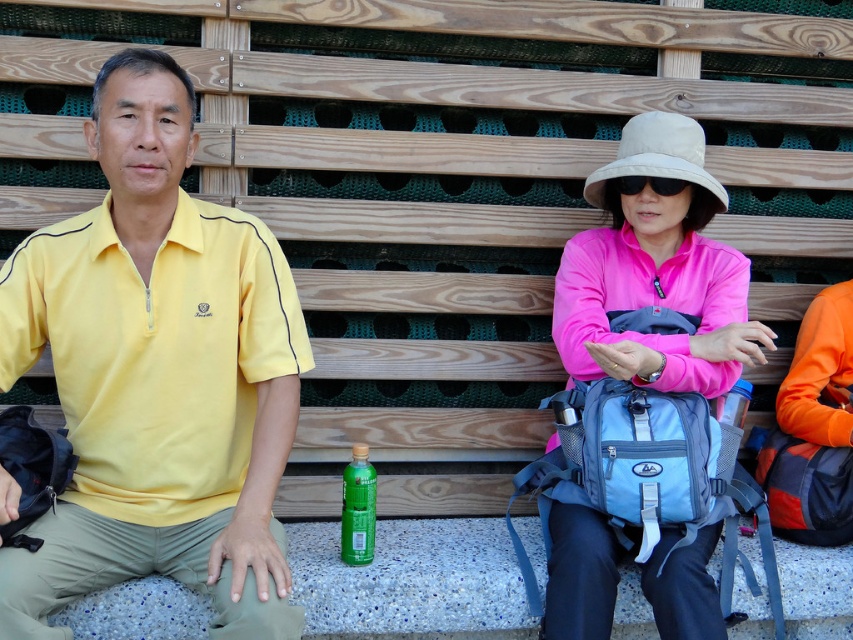
From the picture: Is pink satin hat at upper center to the left of green matte bottle at center from the viewer's perspective?

Incorrect, pink satin hat at upper center is not on the left side of green matte bottle at center.

Does pink satin hat at upper center have a greater height compared to green matte bottle at center?

Indeed, pink satin hat at upper center has a greater height compared to green matte bottle at center.

Does point (569, 298) come closer to viewer compared to point (352, 522)?

No.

The width and height of the screenshot is (853, 640). Identify the location of pink satin hat at upper center. (656, 269).

Does yellow matte shirt at left appear on the right side of pink satin hat at upper center?

In fact, yellow matte shirt at left is to the left of pink satin hat at upper center.

Is yellow matte shirt at left smaller than pink satin hat at upper center?

No, yellow matte shirt at left is not smaller than pink satin hat at upper center.

Which is in front, point (212, 464) or point (614, 371)?

Positioned in front is point (212, 464).

At what (x,y) coordinates should I click in order to perform the action: click on yellow matte shirt at left. Please return your answer as a coordinate pair (x, y). The width and height of the screenshot is (853, 640). Looking at the image, I should click on (157, 374).

Which is above, yellow matte shirt at left or green matte bottle at center?

yellow matte shirt at left is above.

Can you confirm if yellow matte shirt at left is shorter than green matte bottle at center?

No.

Between point (190, 380) and point (372, 518), which one is positioned in front?

Point (190, 380) is more forward.

At what (x,y) coordinates should I click in order to perform the action: click on yellow matte shirt at left. Please return your answer as a coordinate pair (x, y). Looking at the image, I should click on (157, 374).